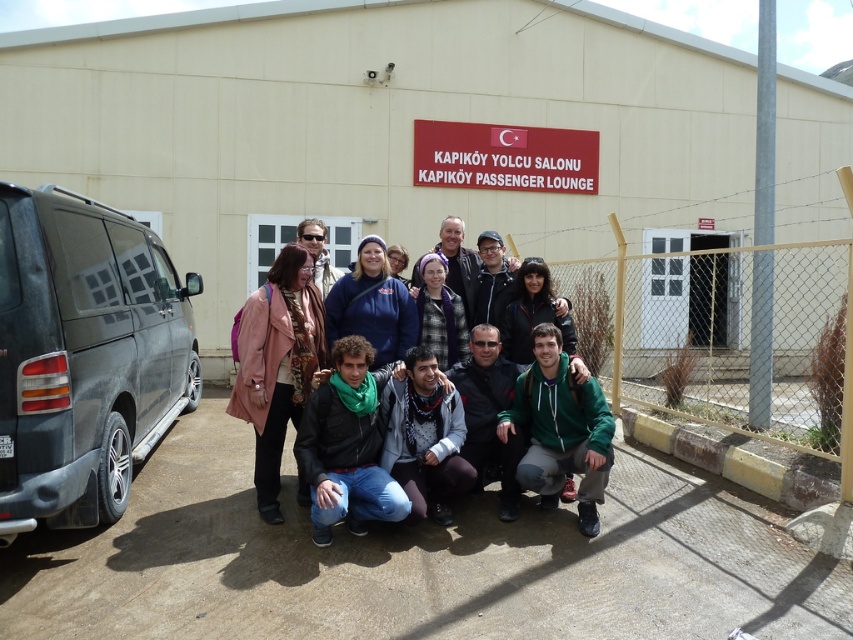
Question: Does green fleece jacket at center have a larger size compared to purple fuzzy hat at center?

Choices:
 (A) yes
 (B) no

Answer: (A)

Question: Does green fleece jacket at center appear on the left side of matte black jacket at center?

Choices:
 (A) no
 (B) yes

Answer: (B)

Question: Among these points, which one is nearest to the camera?

Choices:
 (A) (265, 349)
 (B) (299, 328)
 (C) (373, 504)
 (D) (363, 278)

Answer: (C)

Question: Which object is farther from the camera taking this photo?

Choices:
 (A) gray knit sweater at center
 (B) matte black jacket at center
 (C) metal chain-link fence at lower right
 (D) green fleece jacket at lower center

Answer: (B)

Question: Which point appears farthest from the camera in this image?

Choices:
 (A) (440, 493)
 (B) (751, 269)

Answer: (B)

Question: Is the position of green scarf at center more distant than that of blue fleece jacket at center?

Choices:
 (A) no
 (B) yes

Answer: (A)